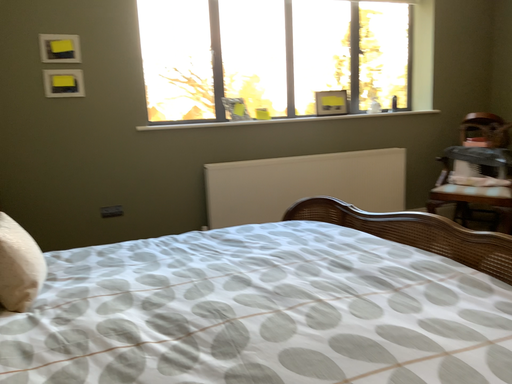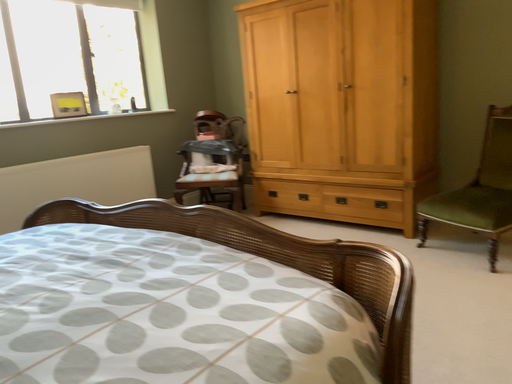
Question: How did the camera likely rotate when shooting the video?

Choices:
 (A) rotated left
 (B) rotated right

Answer: (B)